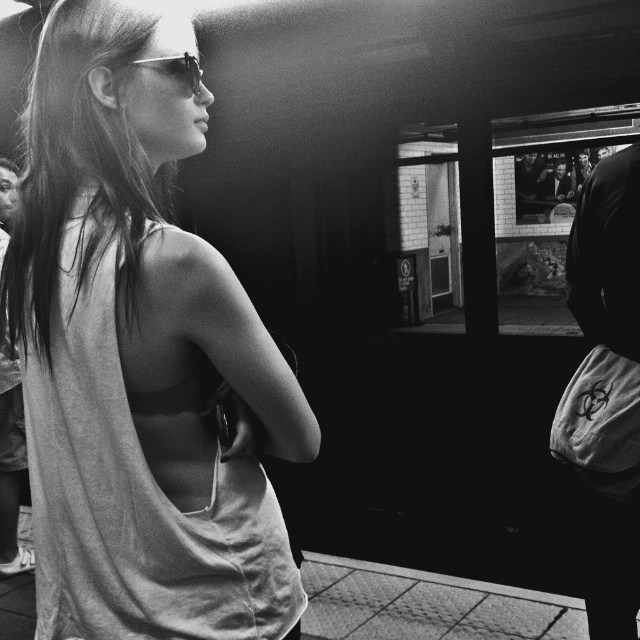
You are a fashion designer analyzing the subway station scene. You notice the matte white tank top at center and the shiny metallic sunglasses at center. Which clothing item is located lower on the woman?

The matte white tank top at center is positioned under the shiny metallic sunglasses at center, so the tank top is lower than the sunglasses.

You are a fashion designer analyzing the subway station scene. You need to determine the exact location of the matte white tank top at center in the image. What are its coordinates?

The coordinates of the matte white tank top at center are at point [140,355].